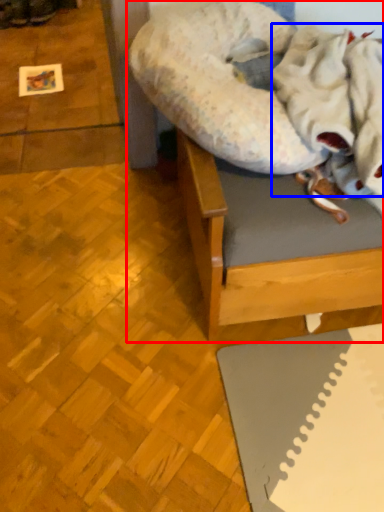
Question: Which object appears farthest to the camera in this image, furniture (highlighted by a red box) or blanket (highlighted by a blue box)?

Choices:
 (A) furniture
 (B) blanket

Answer: (A)